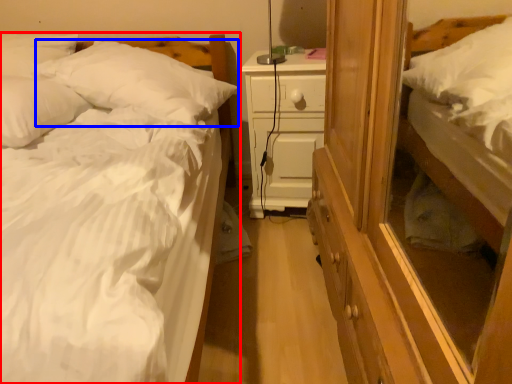
Question: Among these objects, which one is farthest to the camera, bed (highlighted by a red box) or pillow (highlighted by a blue box)?

Choices:
 (A) bed
 (B) pillow

Answer: (B)